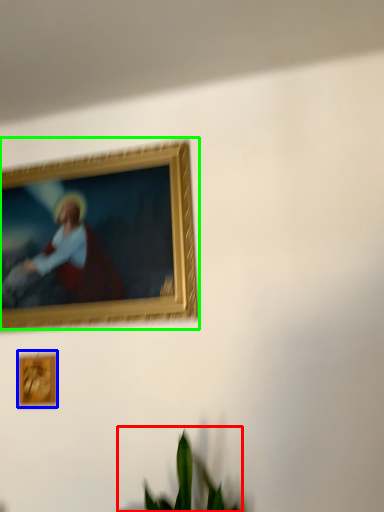
Question: Which object is positioned closest to houseplant (highlighted by a red box)? Select from picture frame (highlighted by a blue box) and picture frame (highlighted by a green box).

Choices:
 (A) picture frame
 (B) picture frame

Answer: (A)